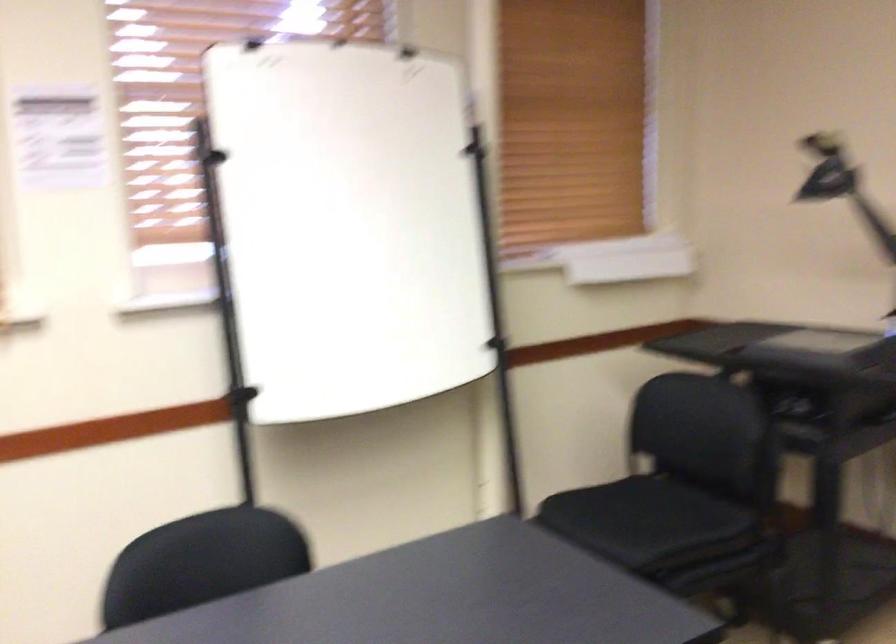
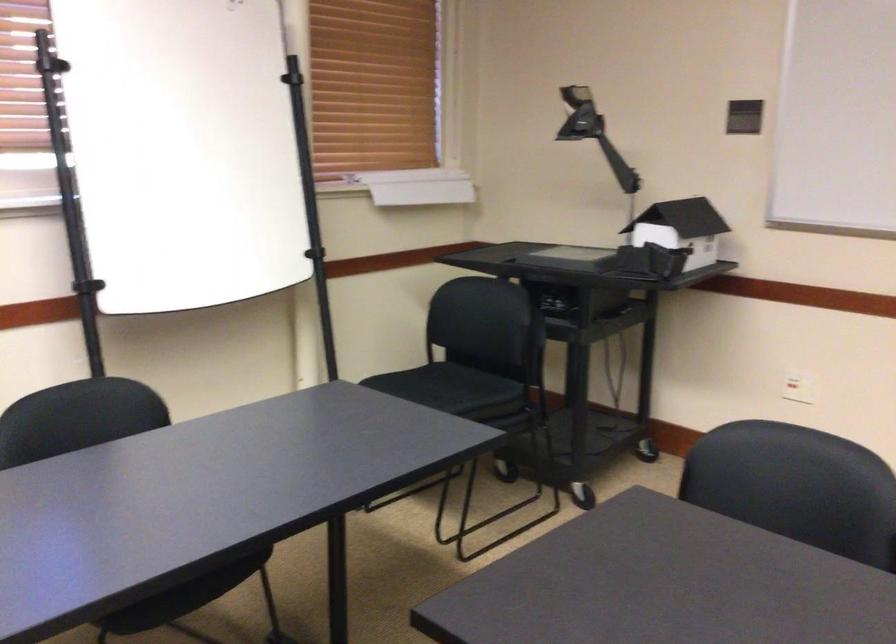
Where in the second image is the point corresponding to [497,346] from the first image?

(321, 254)